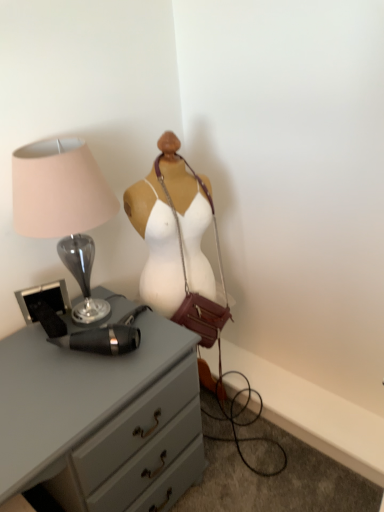
What are the coordinates of `matte glass lamp at left` in the screenshot? It's located at (64, 208).

This screenshot has height=512, width=384. What are the coordinates of `matte gray chest of drawers at center-left` in the screenshot? It's located at (101, 419).

Is leather/maroon handbag at center inside the boundaries of matte glass lamp at left, or outside?

leather/maroon handbag at center is not inside matte glass lamp at left, it's outside.

Locate an element on the screen. Image resolution: width=384 pixels, height=512 pixels. handbag below the matte glass lamp at left (from the image's perspective) is located at coordinates (188, 284).

Which is in front, point (200, 319) or point (50, 178)?

The point (50, 178) is in front.

From a real-world perspective, is leather/maroon handbag at center physically below matte glass lamp at left?

Correct, in the physical world, leather/maroon handbag at center is lower than matte glass lamp at left.

Looking at their sizes, would you say matte glass lamp at left is wider or thinner than matte gray chest of drawers at center-left?

Considering their sizes, matte glass lamp at left looks slimmer than matte gray chest of drawers at center-left.

Is matte glass lamp at left oriented towards matte gray chest of drawers at center-left?

No, matte glass lamp at left is not aimed at matte gray chest of drawers at center-left.

Find the location of `chest of drawers below the matte glass lamp at left (from a real-world perspective)`. chest of drawers below the matte glass lamp at left (from a real-world perspective) is located at coordinates (101, 419).

Can you tell me how much matte glass lamp at left and matte gray chest of drawers at center-left differ in facing direction?

There is a 0.000331-degree angle between the facing directions of matte glass lamp at left and matte gray chest of drawers at center-left.

Which is correct: matte gray chest of drawers at center-left is inside leather/maroon handbag at center, or outside of it?

matte gray chest of drawers at center-left is not inside leather/maroon handbag at center, it's outside.

Can you tell me how much matte gray chest of drawers at center-left and leather/maroon handbag at center differ in facing direction?

matte gray chest of drawers at center-left and leather/maroon handbag at center are facing 26.2 degrees away from each other.

In the scene shown: Is matte gray chest of drawers at center-left wider or thinner than leather/maroon handbag at center?

matte gray chest of drawers at center-left is wider than leather/maroon handbag at center.

In the image, there is a matte gray chest of drawers at center-left. In order to click on handbag above it (from the image's perspective) in this screenshot , I will do `click(188, 284)`.

From a real-world perspective, who is located lower, leather/maroon handbag at center or matte gray chest of drawers at center-left?

In real-world perspective, matte gray chest of drawers at center-left is lower.

Is leather/maroon handbag at center thinner than matte gray chest of drawers at center-left?

Yes.

Is leather/maroon handbag at center in front of or behind matte gray chest of drawers at center-left in the image?

leather/maroon handbag at center is positioned farther from the viewer than matte gray chest of drawers at center-left.

Considering the relative sizes of matte glass lamp at left and leather/maroon handbag at center in the image provided, is matte glass lamp at left wider than leather/maroon handbag at center?

Correct, the width of matte glass lamp at left exceeds that of leather/maroon handbag at center.

I want to click on lamp located above the leather/maroon handbag at center (from a real-world perspective), so click(x=64, y=208).

From a real-world perspective, between matte glass lamp at left and leather/maroon handbag at center, who is vertically lower?

leather/maroon handbag at center.

Could you tell me if matte glass lamp at left is turned towards leather/maroon handbag at center?

No, matte glass lamp at left is not oriented towards leather/maroon handbag at center.

Does matte gray chest of drawers at center-left turn towards matte glass lamp at left?

No, matte gray chest of drawers at center-left is not aimed at matte glass lamp at left.

From a real-world perspective, who is located lower, matte gray chest of drawers at center-left or matte glass lamp at left?

In real-world perspective, matte gray chest of drawers at center-left is lower.

Is the surface of matte gray chest of drawers at center-left in direct contact with matte glass lamp at left?

No, matte gray chest of drawers at center-left is not touching matte glass lamp at left.

Locate an element on the screen. lamp positioned vertically above the leather/maroon handbag at center (from a real-world perspective) is located at coordinates (64, 208).

Where is `lamp that appears on the left of matte gray chest of drawers at center-left`? This screenshot has width=384, height=512. lamp that appears on the left of matte gray chest of drawers at center-left is located at coordinates (64, 208).

Considering their positions, is leather/maroon handbag at center positioned closer to matte glass lamp at left than matte gray chest of drawers at center-left?

The object closer to matte glass lamp at left is leather/maroon handbag at center.

When comparing their distances from matte gray chest of drawers at center-left, does leather/maroon handbag at center or matte glass lamp at left seem closer?

matte glass lamp at left is positioned closer to the anchor matte gray chest of drawers at center-left.

Which object lies nearer to the anchor point leather/maroon handbag at center, matte glass lamp at left or matte gray chest of drawers at center-left?

The object closer to leather/maroon handbag at center is matte glass lamp at left.

Considering their positions, is matte glass lamp at left positioned further to matte gray chest of drawers at center-left than leather/maroon handbag at center?

Among the two, leather/maroon handbag at center is located further to matte gray chest of drawers at center-left.

From the image, which object appears to be farther from leather/maroon handbag at center, matte gray chest of drawers at center-left or matte glass lamp at left?

Based on the image, matte gray chest of drawers at center-left appears to be further to leather/maroon handbag at center.

Looking at the image, which one is located closer to matte glass lamp at left, matte gray chest of drawers at center-left or leather/maroon handbag at center?

leather/maroon handbag at center is positioned closer to the anchor matte glass lamp at left.

Where is `handbag between matte glass lamp at left and matte gray chest of drawers at center-left vertically`? Image resolution: width=384 pixels, height=512 pixels. handbag between matte glass lamp at left and matte gray chest of drawers at center-left vertically is located at coordinates (188, 284).